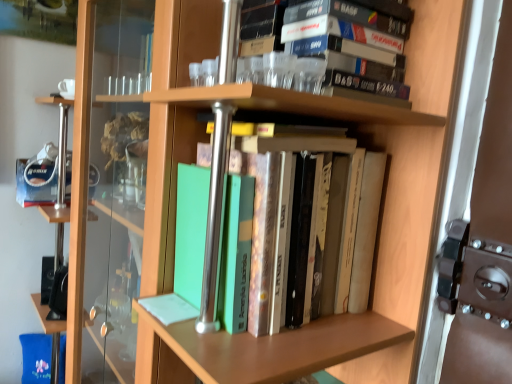
Question: Based on their positions, is green matte book at center, positioned as the 2th book in top-to-bottom order, located to the left or right of matte black cassette tape at upper center, the 1th book positioned from the top?

Choices:
 (A) left
 (B) right

Answer: (A)

Question: In terms of width, does green matte book at center, positioned as the 2th book in top-to-bottom order, look wider or thinner when compared to matte black cassette tape at upper center, arranged as the second book when ordered from the bottom?

Choices:
 (A) wide
 (B) thin

Answer: (A)

Question: Based on their sizes in the image, would you say green matte book at center, positioned as the 2th book in top-to-bottom order, is bigger or smaller than matte black cassette tape at upper center, the 1th book positioned from the top?

Choices:
 (A) small
 (B) big

Answer: (B)

Question: Considering the positions of matte black cassette tape at upper center, the 1th book positioned from the top, and green matte book at center, positioned as the 2th book in top-to-bottom order, in the image, is matte black cassette tape at upper center, the 1th book positioned from the top, bigger or smaller than green matte book at center, positioned as the 2th book in top-to-bottom order,?

Choices:
 (A) small
 (B) big

Answer: (A)

Question: Considering the positions of point (326, 54) and point (289, 226), is point (326, 54) closer or farther from the camera than point (289, 226)?

Choices:
 (A) farther
 (B) closer

Answer: (B)

Question: Relative to green matte book at center, positioned as the 2th book in top-to-bottom order, is matte black cassette tape at upper center, the 1th book positioned from the top, in front or behind?

Choices:
 (A) front
 (B) behind

Answer: (B)

Question: From a real-world perspective, is matte black cassette tape at upper center, the 1th book positioned from the top, physically located above or below green matte book at center, which is the first book in bottom-to-top order?

Choices:
 (A) above
 (B) below

Answer: (A)